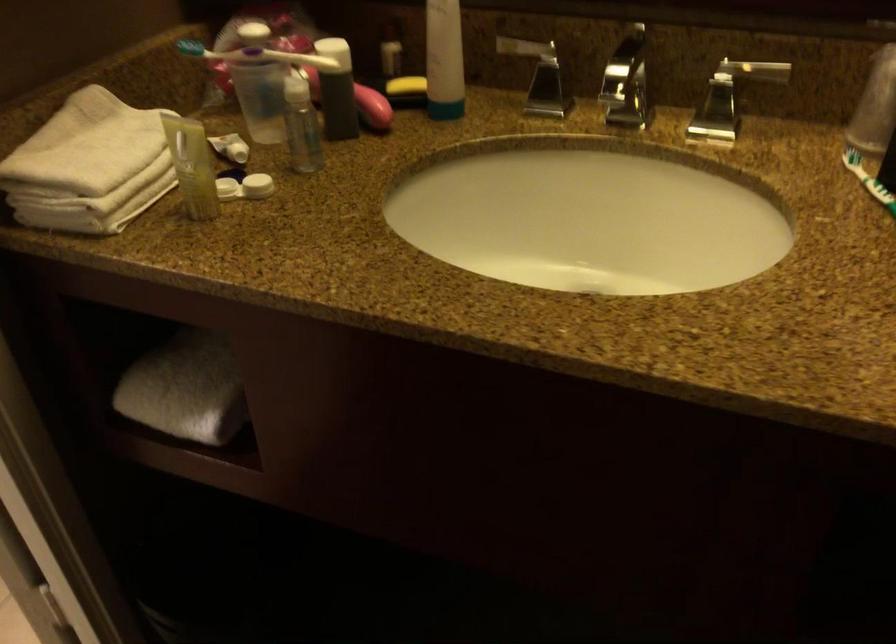
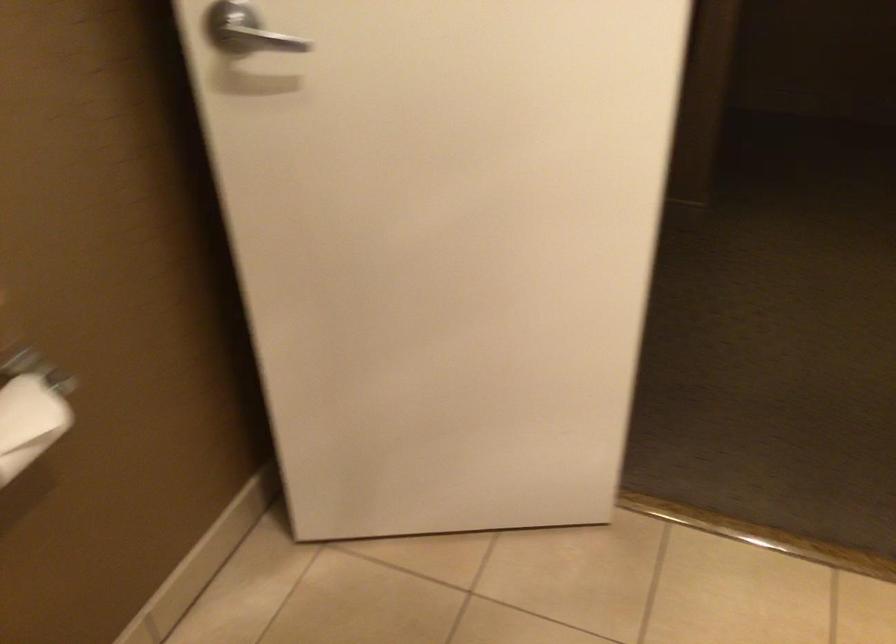
Question: I am providing you with two images of the same scene from different viewpoints. After the viewpoint changes to image2, which objects are now occluded?

Choices:
 (A) orange handle scissors
 (B) silver door handle
 (C) rolled white towel
 (D) toilet paper roll

Answer: (C)